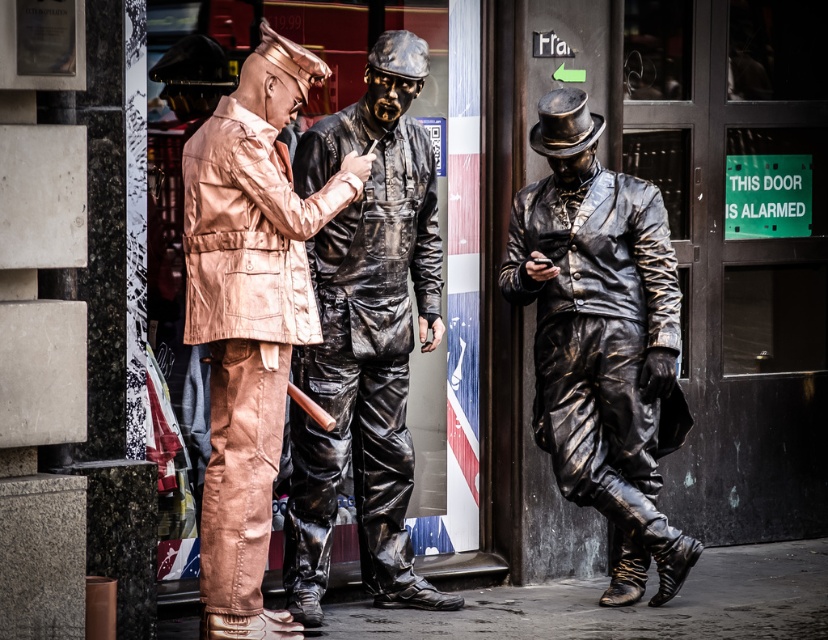
Question: Which of the following is the closest to the observer?

Choices:
 (A) shiny bronze jacket at center
 (B) shiny black suit at center
 (C) shiny bronze statue at center

Answer: (A)

Question: Does shiny black suit at center appear over shiny bronze statue at center?

Choices:
 (A) no
 (B) yes

Answer: (B)

Question: Can you confirm if shiny black suit at center is bigger than shiny bronze jacket at center?

Choices:
 (A) yes
 (B) no

Answer: (A)

Question: Where is shiny bronze statue at center located in relation to shiny bronze jacket at center in the image?

Choices:
 (A) right
 (B) left

Answer: (A)

Question: Which point is farther from the camera taking this photo?

Choices:
 (A) (532, 284)
 (B) (215, 208)
 (C) (398, 268)

Answer: (A)

Question: Which object is closer to the camera taking this photo?

Choices:
 (A) shiny bronze statue at center
 (B) shiny black suit at center

Answer: (B)